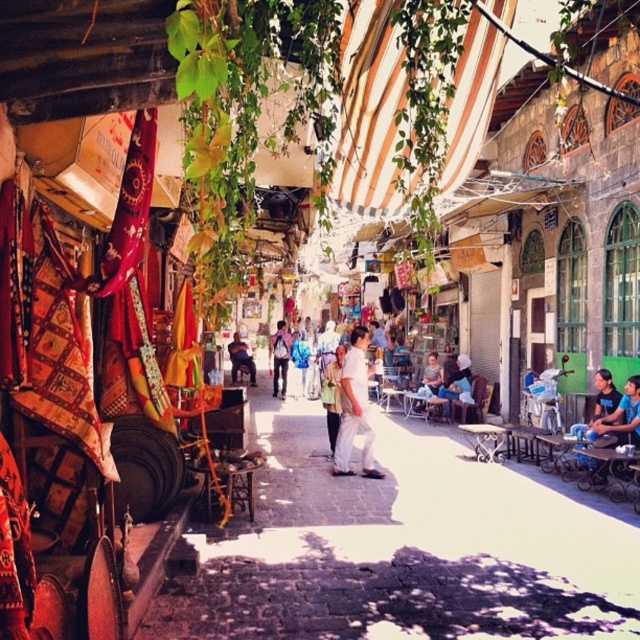
Question: Which of the following is the closest to the observer?

Choices:
 (A) (289, 346)
 (B) (330, 577)
 (C) (252, 384)

Answer: (B)

Question: Can you confirm if white cotton shirt at center is wider than light brown leather backpack at center?

Choices:
 (A) yes
 (B) no

Answer: (A)

Question: Does white cotton shirt at center appear on the right side of dark brown leather bag at center?

Choices:
 (A) no
 (B) yes

Answer: (B)

Question: Does light brown leather backpack at center appear under dark blue t-shirt at right?

Choices:
 (A) yes
 (B) no

Answer: (B)

Question: Which object appears closest to the camera in this image?

Choices:
 (A) dark brown leather bag at center
 (B) white fabric at center

Answer: (B)

Question: Among these points, which one is nearest to the camera?

Choices:
 (A) (237, 348)
 (B) (282, 369)
 (C) (353, 436)

Answer: (C)